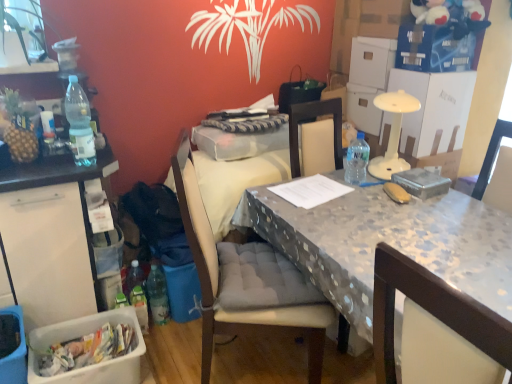
Question: Is plastic picnic basket at lower left looking in the opposite direction of fabric cushioned chair at center?

Choices:
 (A) yes
 (B) no

Answer: (B)

Question: From a real-world perspective, is plastic picnic basket at lower left located beneath fabric cushioned chair at center?

Choices:
 (A) no
 (B) yes

Answer: (B)

Question: From the image's perspective, does plastic picnic basket at lower left appear lower than fabric cushioned chair at center?

Choices:
 (A) no
 (B) yes

Answer: (B)

Question: Is plastic picnic basket at lower left located outside fabric cushioned chair at center?

Choices:
 (A) no
 (B) yes

Answer: (B)

Question: From the image's perspective, is plastic picnic basket at lower left above fabric cushioned chair at center?

Choices:
 (A) yes
 (B) no

Answer: (B)

Question: In terms of size, does translucent plastic bottle at left, positioned as the 3th bottle in back-to-front order, appear bigger or smaller than polka dot fabric table at center?

Choices:
 (A) small
 (B) big

Answer: (A)

Question: From the image's perspective, relative to polka dot fabric table at center, is translucent plastic bottle at left, the 1th bottle viewed from the top, above or below?

Choices:
 (A) above
 (B) below

Answer: (A)

Question: Considering their positions, is translucent plastic bottle at left, placed as the third bottle when sorted from right to left, located in front of or behind polka dot fabric table at center?

Choices:
 (A) behind
 (B) front

Answer: (A)

Question: Is translucent plastic bottle at left, the first bottle positioned from the front, wider or thinner than polka dot fabric table at center?

Choices:
 (A) thin
 (B) wide

Answer: (A)

Question: Is white plastic bin at left wider or thinner than fabric cushioned chair at center?

Choices:
 (A) thin
 (B) wide

Answer: (A)

Question: Relative to fabric cushioned chair at center, is white plastic bin at left in front or behind?

Choices:
 (A) front
 (B) behind

Answer: (B)

Question: Is point (47, 243) positioned closer to the camera than point (201, 284)?

Choices:
 (A) farther
 (B) closer

Answer: (B)

Question: Based on their sizes in the image, would you say white plastic bin at left is bigger or smaller than fabric cushioned chair at center?

Choices:
 (A) small
 (B) big

Answer: (A)

Question: Is point (83, 264) positioned closer to the camera than point (1, 362)?

Choices:
 (A) farther
 (B) closer

Answer: (A)

Question: From the image's perspective, relative to plastic picnic basket at lower left, is white plastic bin at left above or below?

Choices:
 (A) below
 (B) above

Answer: (B)